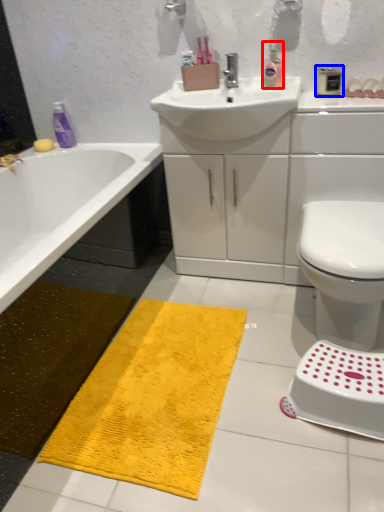
Question: Which of the following is the closest to the observer, cleaning product (highlighted by a red box) or mouthwash (highlighted by a blue box)?

Choices:
 (A) cleaning product
 (B) mouthwash

Answer: (B)